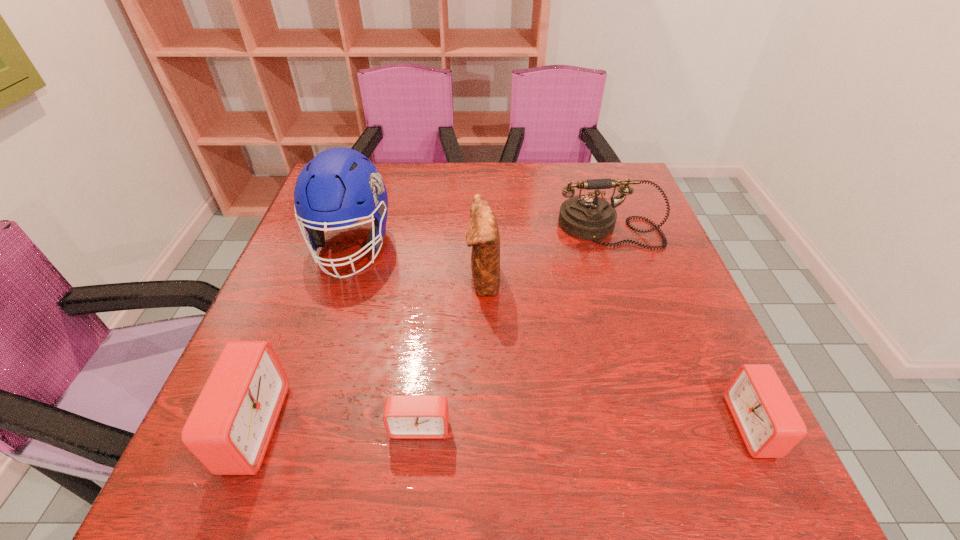
In order to click on the leftmost alarm clock in this screenshot , I will do `click(230, 426)`.

This screenshot has width=960, height=540. In order to click on the second alarm clock from right to left in this screenshot , I will do `click(405, 416)`.

The image size is (960, 540). Find the location of `the shortest alarm clock`. the shortest alarm clock is located at coordinates (405, 416).

At what (x,y) coordinates should I click in order to perform the action: click on the second shortest object. Please return your answer as a coordinate pair (x, y). This screenshot has height=540, width=960. Looking at the image, I should click on (770, 425).

Identify the location of the rightmost alarm clock. The height and width of the screenshot is (540, 960). (770, 425).

Find the location of a particular element. This screenshot has height=540, width=960. telephone is located at coordinates tap(587, 217).

You are a GUI agent. You are given a task and a screenshot of the screen. Output one action in this format:
    pyautogui.click(x=<x>, y=<y>)
    Task: Click on the second tallest object
    
    Given the screenshot: What is the action you would take?
    pyautogui.click(x=482, y=234)

Locate an element on the screen. This screenshot has height=540, width=960. the fourth object from left to right is located at coordinates (482, 234).

Where is `football helmet`? The image size is (960, 540). football helmet is located at coordinates (340, 186).

The width and height of the screenshot is (960, 540). In order to click on vacant space located on the front-facing side of the tallest alarm clock in this screenshot , I will do `click(372, 428)`.